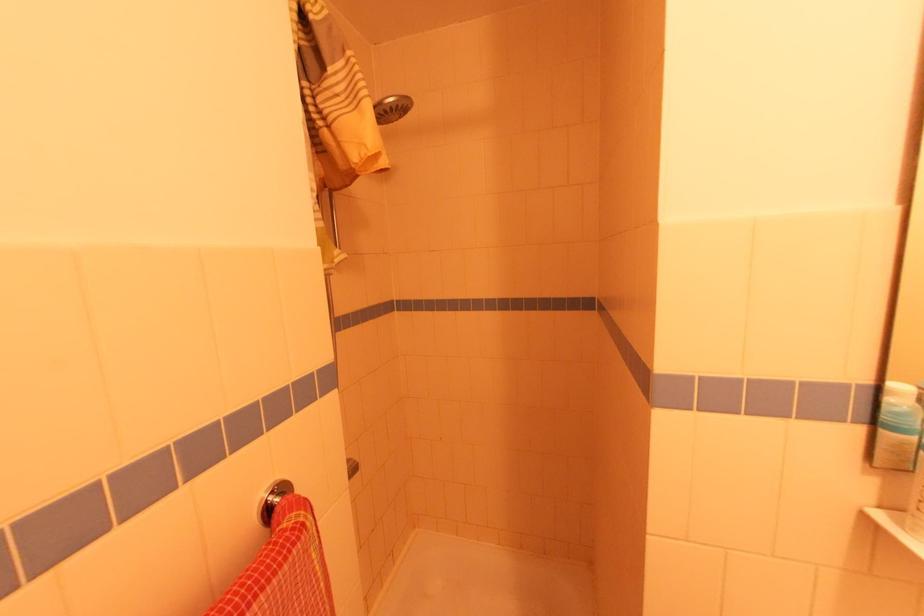
Where is `shower faucet knob`? The height and width of the screenshot is (616, 924). shower faucet knob is located at coordinates (392, 108).